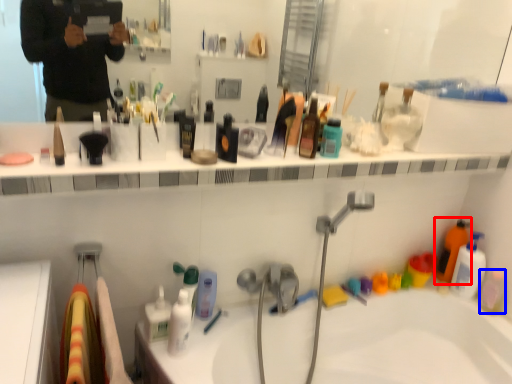
Question: Among these objects, which one is nearest to the camera, cleaning product (highlighted by a red box) or mouthwash (highlighted by a blue box)?

Choices:
 (A) cleaning product
 (B) mouthwash

Answer: (B)